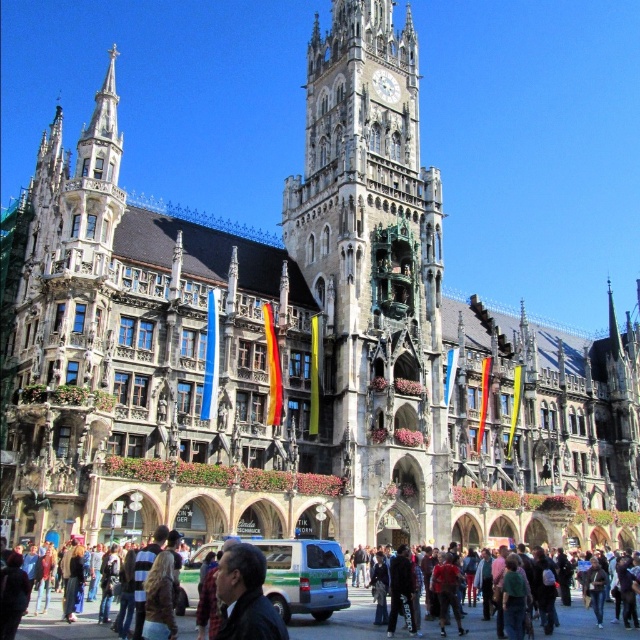
Question: Is golden stone clock tower at center smaller than dark clothing crowd at lower center?

Choices:
 (A) no
 (B) yes

Answer: (A)

Question: Which of the following is the closest to the observer?

Choices:
 (A) golden stone clock tower at center
 (B) dark blue leather jacket at lower center

Answer: (B)

Question: Is golden stone clock tower at center behind dark blue leather jacket at lower center?

Choices:
 (A) no
 (B) yes

Answer: (B)

Question: Which point appears closest to the camera in this image?

Choices:
 (A) [282, 637]
 (B) [328, 202]

Answer: (A)

Question: From the image, what is the correct spatial relationship of golden stone clock tower at center in relation to dark clothing crowd at lower center?

Choices:
 (A) above
 (B) below

Answer: (A)

Question: Which point is closer to the camera taking this photo?

Choices:
 (A) (451, 618)
 (B) (253, 580)

Answer: (B)